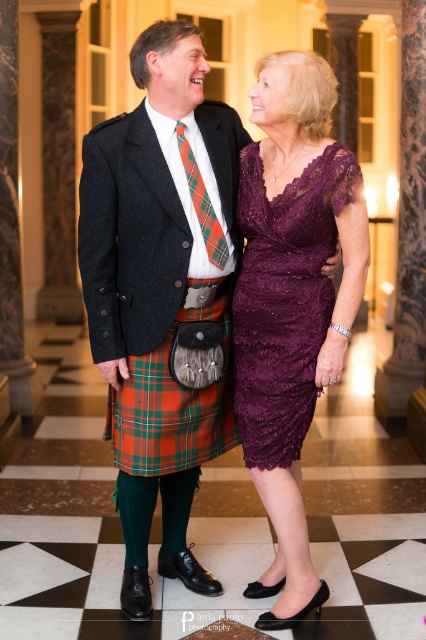
From the picture: You are a photographer preparing to take a portrait of the two people in the scene. You want to ensure that both the velvet purple dress at center and the plaid fabric tie at center are clearly visible in the photo. Given their sizes, which one should you focus on first to ensure proper exposure?

The velvet purple dress at center has a larger size compared to plaid fabric tie at center, so you should focus on the velvet purple dress at center first to ensure proper exposure since it occupies more space in the frame.

You are a photographer setting up a shoot in the grand hallway. You need to position a 1.2 meter wide backdrop behind the velvet purple dress at center and orange plaid kilt at center. Will the backdrop be wide enough to cover both objects without overlapping the edges?

The velvet purple dress at center is narrower than the orange plaid kilt at center. Since the total width required would be the sum of both objects plus spacing between them, but the given information only states the dress is narrower than the kilt. Without knowing the exact widths or spacing, it is impossible to determine if the 1.2 meter backdrop is sufficient. However, if the combined width of both objects plus spacing exceeds 1.2 meters, the backdrop may not be wide enough. Further measurements are need